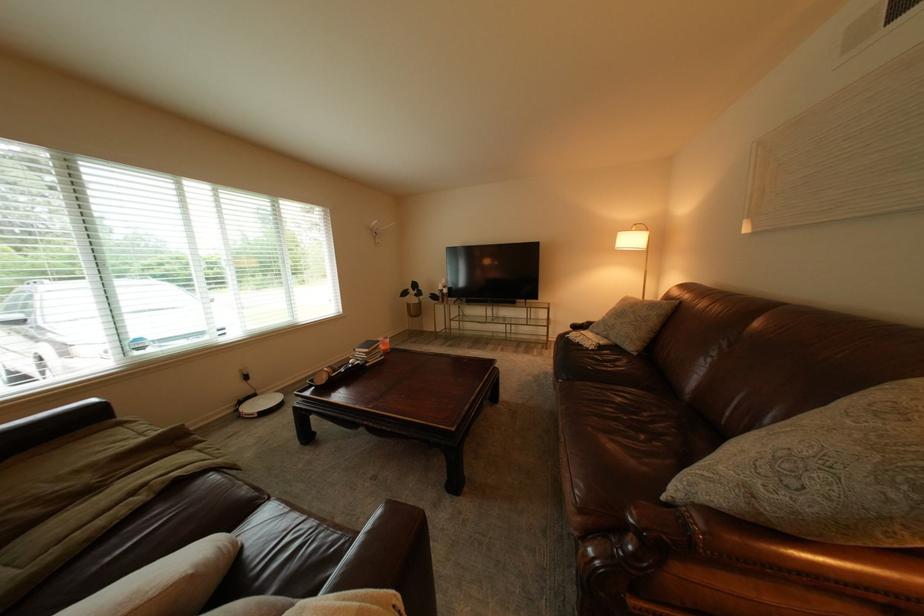
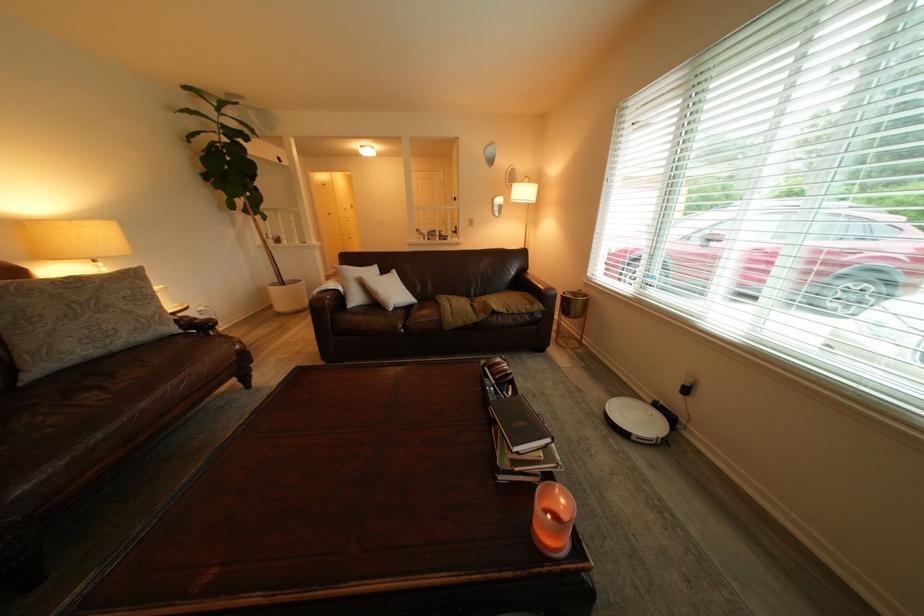
Where in the second image is the point corresponding to (150,422) from the first image?

(546, 309)